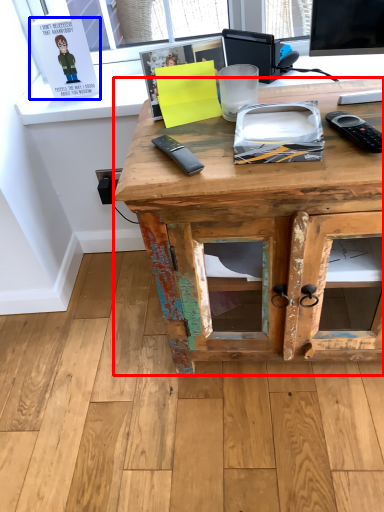
Question: Among these objects, which one is farthest to the camera, desk (highlighted by a red box) or book (highlighted by a blue box)?

Choices:
 (A) desk
 (B) book

Answer: (B)